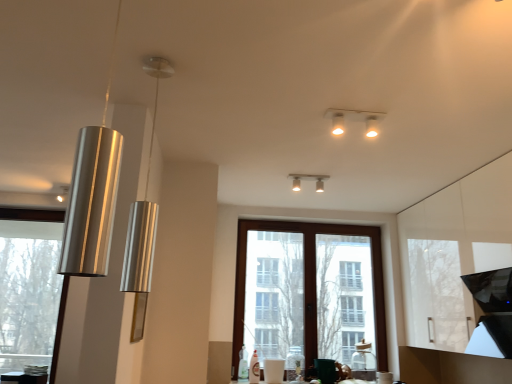
Question: Can you confirm if clear glass window at left, which ranks as the second window in right-to-left order, is positioned to the left of matte silver light fixture at upper center, the 4th lamp from the left?

Choices:
 (A) no
 (B) yes

Answer: (B)

Question: Can you confirm if clear glass window at left, which ranks as the second window in right-to-left order, is thinner than matte silver light fixture at upper center, positioned as the 4th lamp in front-to-back order?

Choices:
 (A) no
 (B) yes

Answer: (A)

Question: Is the depth of clear glass window at left, which ranks as the second window in right-to-left order, greater than that of matte silver light fixture at upper center, the 4th lamp from the left?

Choices:
 (A) yes
 (B) no

Answer: (A)

Question: From the image's perspective, would you say clear glass window at left, which ranks as the second window in right-to-left order, is positioned over matte silver light fixture at upper center, positioned as the 4th lamp in front-to-back order?

Choices:
 (A) no
 (B) yes

Answer: (A)

Question: Is clear glass window at left, which ranks as the second window in right-to-left order, looking in the opposite direction of matte silver light fixture at upper center, the second lamp in the right-to-left sequence?

Choices:
 (A) yes
 (B) no

Answer: (B)

Question: In terms of height, does metallic cylinder at left, acting as the fifth lamp starting from the front, look taller or shorter compared to silver/metallic pendant light at left, the fourth lamp when ordered from right to left?

Choices:
 (A) tall
 (B) short

Answer: (B)

Question: Visually, is metallic cylinder at left, marked as the 1th lamp in a left-to-right arrangement, positioned to the left or to the right of silver/metallic pendant light at left, the fourth lamp when ordered from right to left?

Choices:
 (A) left
 (B) right

Answer: (A)

Question: Considering the positions of point (58, 198) and point (148, 162), is point (58, 198) closer or farther from the camera than point (148, 162)?

Choices:
 (A) closer
 (B) farther

Answer: (B)

Question: Based on their sizes in the image, would you say metallic cylinder at left, which appears as the 5th lamp when viewed from the right, is bigger or smaller than silver/metallic pendant light at left, which is the 4th lamp in back-to-front order?

Choices:
 (A) small
 (B) big

Answer: (A)

Question: Considering the positions of matte silver light fixture at upper center, which is the 2th lamp from back to front, and silver/metallic pendant light at left, which is the 4th lamp in back-to-front order, in the image, is matte silver light fixture at upper center, which is the 2th lamp from back to front, bigger or smaller than silver/metallic pendant light at left, which is the 4th lamp in back-to-front order,?

Choices:
 (A) big
 (B) small

Answer: (B)

Question: Considering the relative positions of matte silver light fixture at upper center, the 4th lamp from the left, and silver/metallic pendant light at left, positioned as the 2th lamp in front-to-back order, in the image provided, is matte silver light fixture at upper center, the 4th lamp from the left, to the left or to the right of silver/metallic pendant light at left, positioned as the 2th lamp in front-to-back order,?

Choices:
 (A) left
 (B) right

Answer: (B)

Question: Looking at their shapes, would you say matte silver light fixture at upper center, which is the 2th lamp from back to front, is wider or thinner than silver/metallic pendant light at left, the fourth lamp when ordered from right to left?

Choices:
 (A) wide
 (B) thin

Answer: (B)

Question: From a real-world perspective, is matte silver light fixture at upper center, the second lamp in the right-to-left sequence, physically located above or below silver/metallic pendant light at left, the fourth lamp when ordered from right to left?

Choices:
 (A) above
 (B) below

Answer: (A)

Question: From the image's perspective, relative to brown wooden window at center, which ranks as the 1th window in right-to-left order, is white glossy light fixture at upper center, marked as the third lamp in a front-to-back arrangement, above or below?

Choices:
 (A) above
 (B) below

Answer: (A)

Question: Is white glossy light fixture at upper center, placed as the 5th lamp when sorted from left to right, in front of or behind brown wooden window at center, which ranks as the 1th window in right-to-left order, in the image?

Choices:
 (A) behind
 (B) front

Answer: (B)